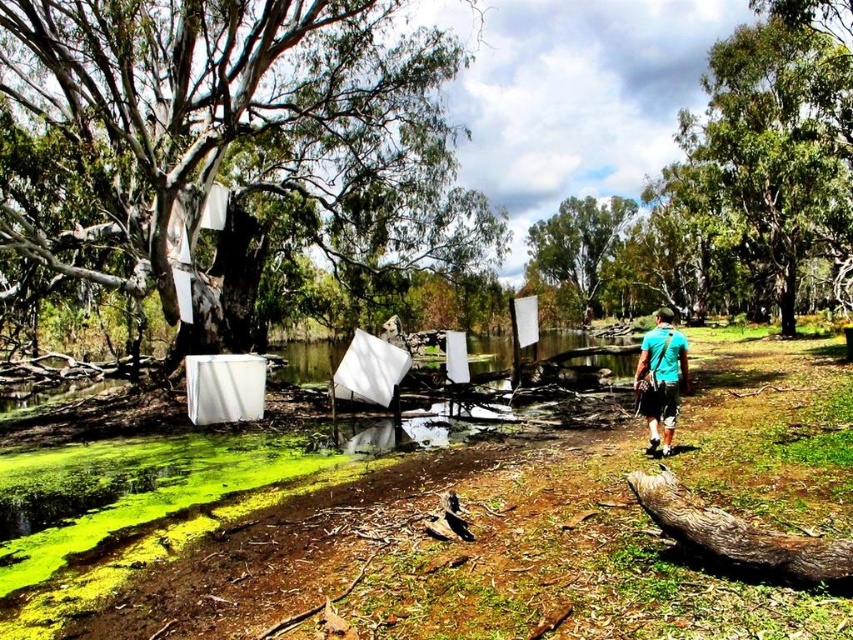
Question: Can you confirm if smooth bark tree at left is thinner than green leafy tree at upper center?

Choices:
 (A) no
 (B) yes

Answer: (A)

Question: Is green leafy tree at upper right positioned in front of teal fabric shirt at center-right?

Choices:
 (A) yes
 (B) no

Answer: (B)

Question: Is green leafy tree at upper right to the right of green leafy tree at upper center from the viewer's perspective?

Choices:
 (A) no
 (B) yes

Answer: (B)

Question: Among these objects, which one is farthest from the camera?

Choices:
 (A) smooth bark tree at left
 (B) teal fabric shirt at center-right
 (C) green leafy tree at upper center

Answer: (C)

Question: Which is nearer to the green leafy tree at upper right?

Choices:
 (A) green leafy tree at upper center
 (B) teal fabric shirt at center-right

Answer: (B)

Question: Among these points, which one is farthest from the camera?

Choices:
 (A) (440, 125)
 (B) (662, 369)

Answer: (A)